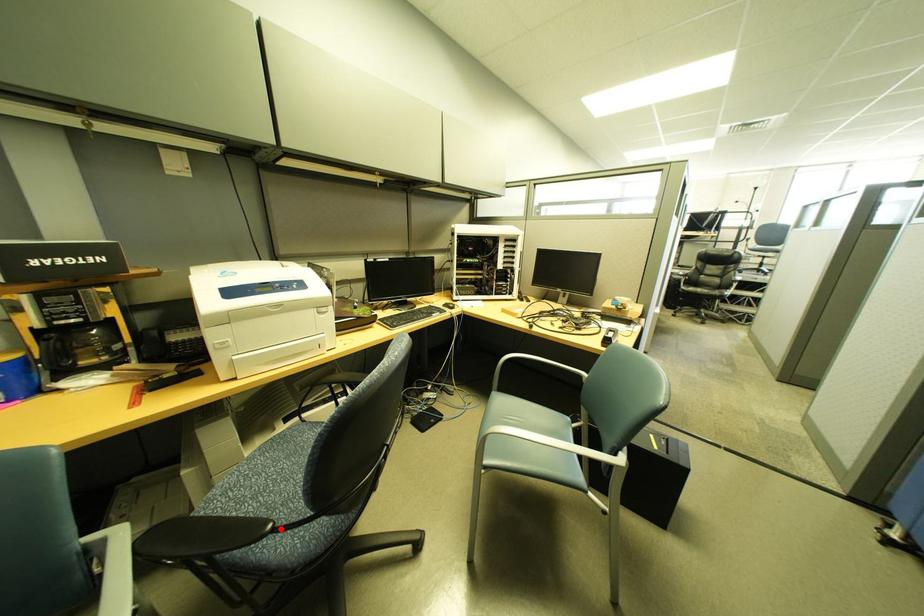
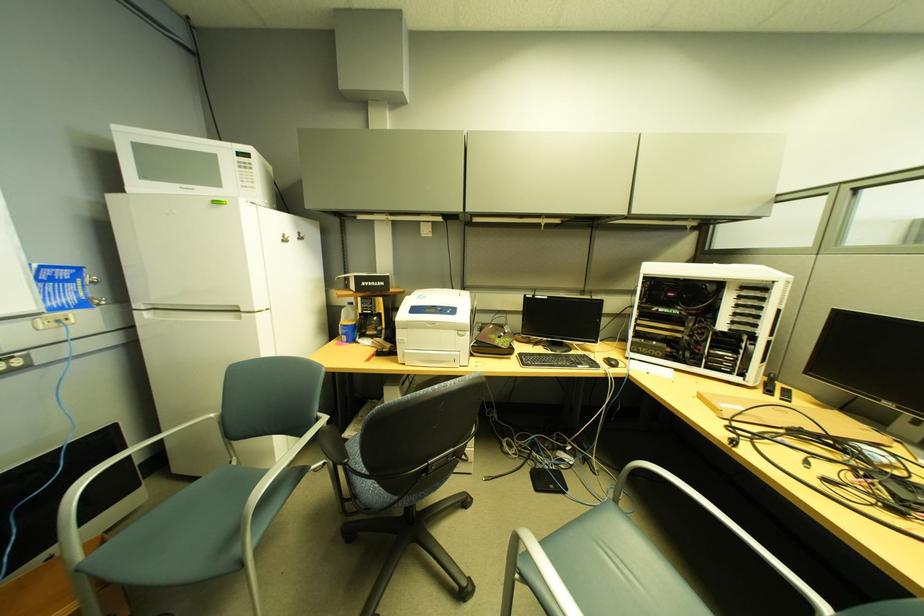
Question: I am providing you with two images of the same scene from different viewpoints. A red point is shown in image1. For the corresponding object point in image2, is it positioned nearer or farther from the camera?

Choices:
 (A) Nearer
 (B) Farther

Answer: (B)